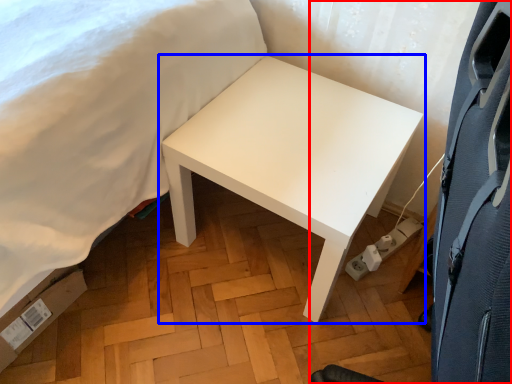
Question: Which of the following is the closest to the observer, swivel chair (highlighted by a red box) or table (highlighted by a blue box)?

Choices:
 (A) swivel chair
 (B) table

Answer: (A)